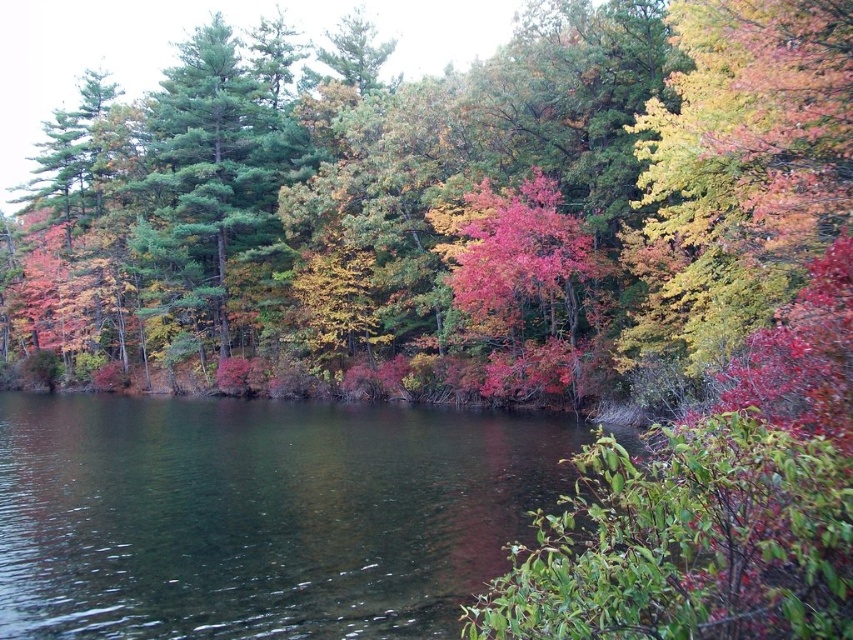
Who is higher up, clear water at center or green matte tree at upper left?

green matte tree at upper left is higher up.

Is clear water at center closer to the viewer compared to green matte tree at upper left?

Yes, clear water at center is in front of green matte tree at upper left.

Identify the location of clear water at center. (260, 515).

This screenshot has width=853, height=640. I want to click on clear water at center, so click(260, 515).